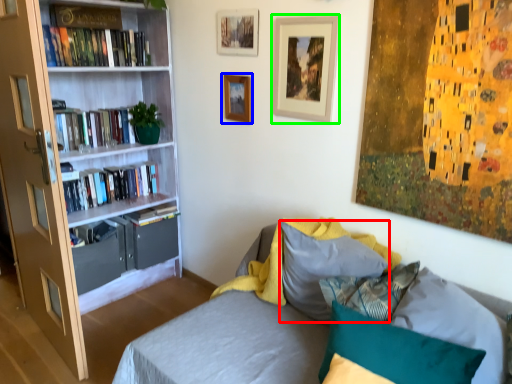
Question: Considering the real-world distances, which object is farthest from pillow (highlighted by a red box)? picture frame (highlighted by a blue box) or picture frame (highlighted by a green box)?

Choices:
 (A) picture frame
 (B) picture frame

Answer: (A)